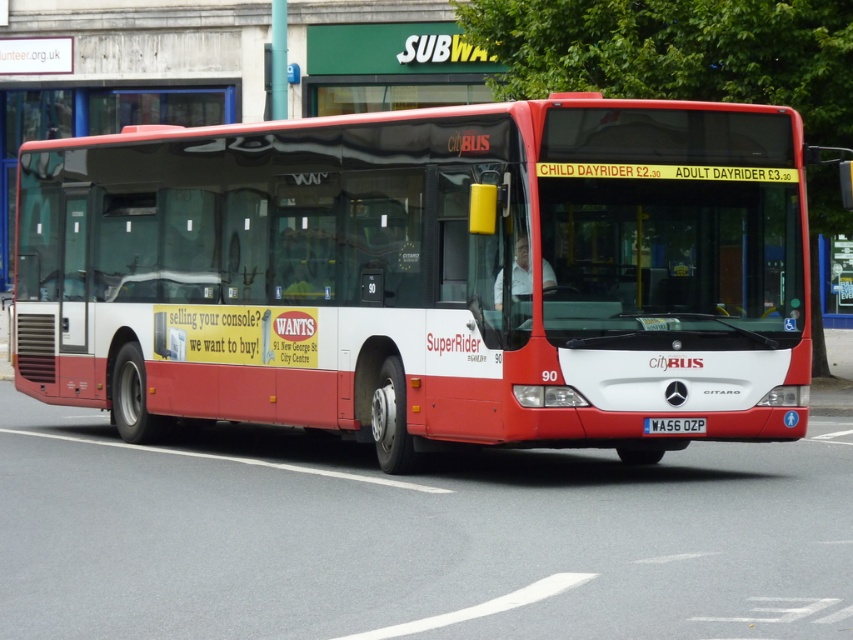
Question: Is matte red bus at center in front of white plastic license plate at center?

Choices:
 (A) yes
 (B) no

Answer: (A)

Question: Which object appears closest to the camera in this image?

Choices:
 (A) matte red bus at center
 (B) white plastic license plate at center

Answer: (A)

Question: Does matte red bus at center have a lesser width compared to white plastic license plate at center?

Choices:
 (A) yes
 (B) no

Answer: (B)

Question: Which of the following is the farthest from the observer?

Choices:
 (A) (657, 364)
 (B) (663, 432)

Answer: (B)

Question: Which of the following is the farthest from the observer?

Choices:
 (A) (660, 429)
 (B) (467, 156)

Answer: (B)

Question: Is the position of matte red bus at center less distant than that of white plastic license plate at center?

Choices:
 (A) no
 (B) yes

Answer: (B)